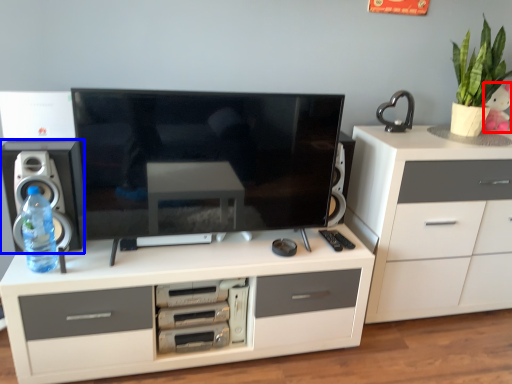
Question: Which of the following is the closest to the observer, toy (highlighted by a red box) or speaker (highlighted by a blue box)?

Choices:
 (A) toy
 (B) speaker

Answer: (B)